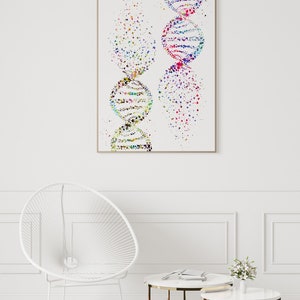
The width and height of the screenshot is (300, 300). In order to click on book in this screenshot , I will do `click(189, 274)`.